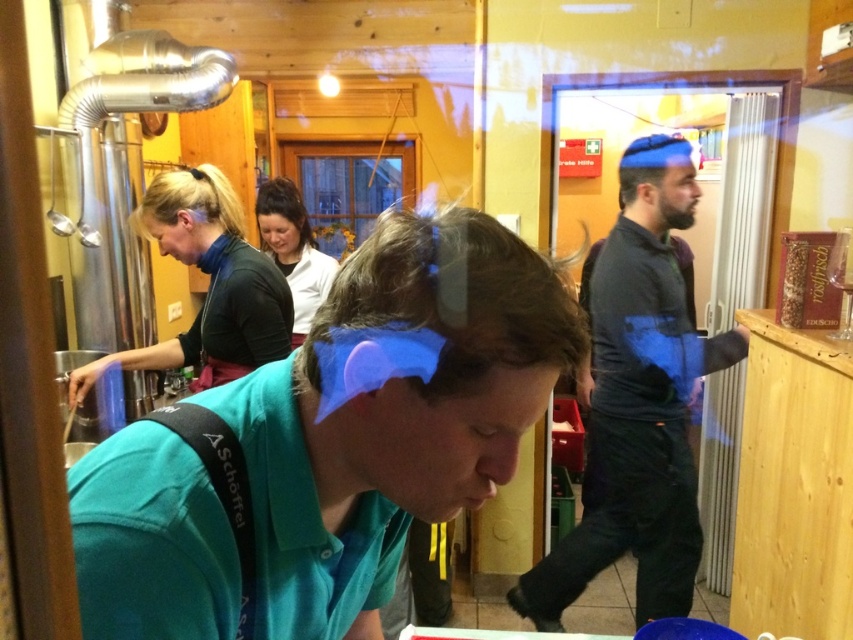
You are standing in the kitchen and see two points marked on the floor. The first point is at position point (358, 452) and the second point is at point (601, 413). If you want to walk towards the point that is closer to you, which point should you head towards?

Point (358, 452) is in front of point (601, 413), so you should head towards point (358, 452) as it is closer to you.

You are a delivery person who needs to place a 1.5 meters long package between the teal fabric shirt at center and the matte black shirt at center. Can you fit the package between them without bending it?

The distance between the teal fabric shirt at center and the matte black shirt at center is 1.41 meters. Since the package is 1.5 meters long, it cannot fit straight between them without bending or adjusting the position of the shirts.